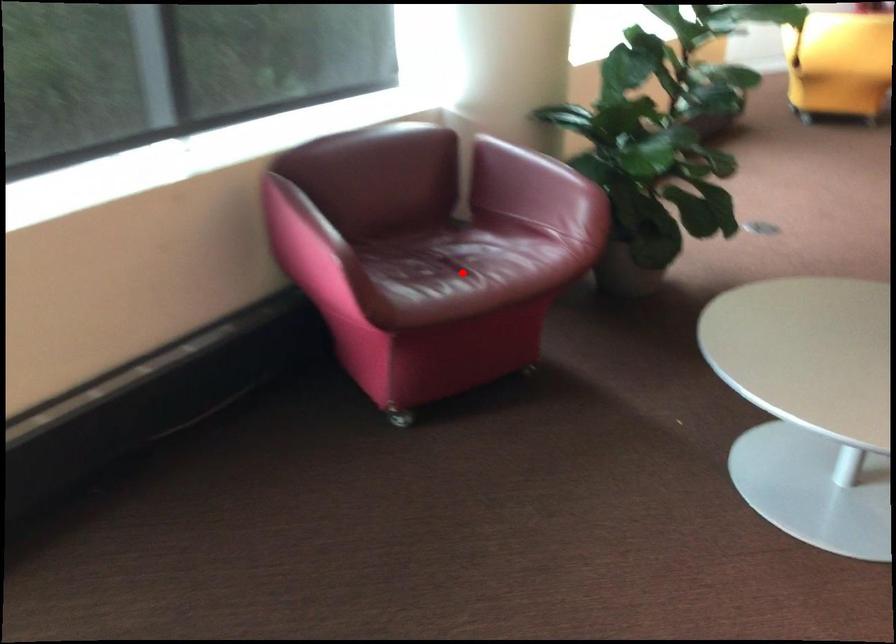
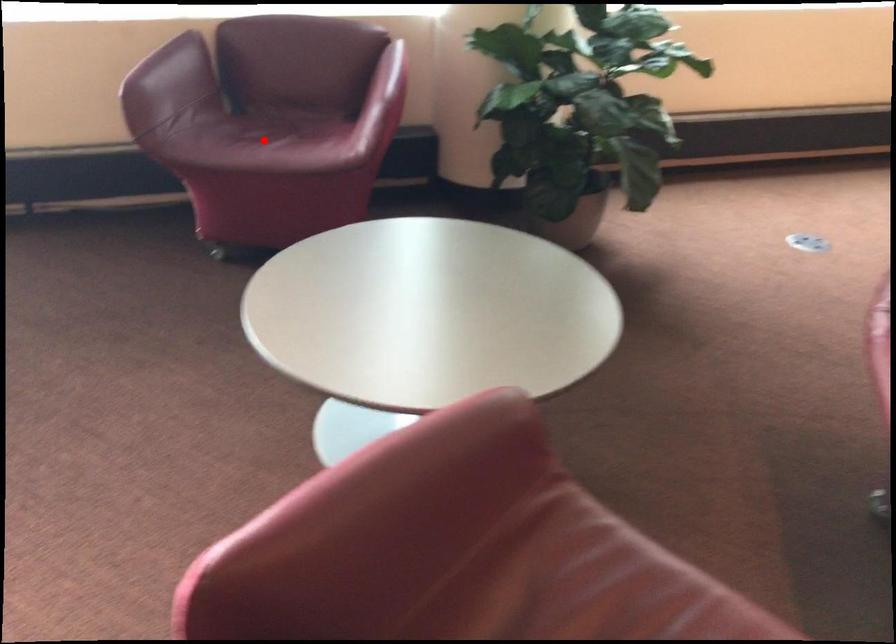
I am providing you with two images of the same scene from different viewpoints. A red point is marked on the first image and another point is marked on the second image. Are the points marked in image1 and image2 representing the same 3D position?

Yes